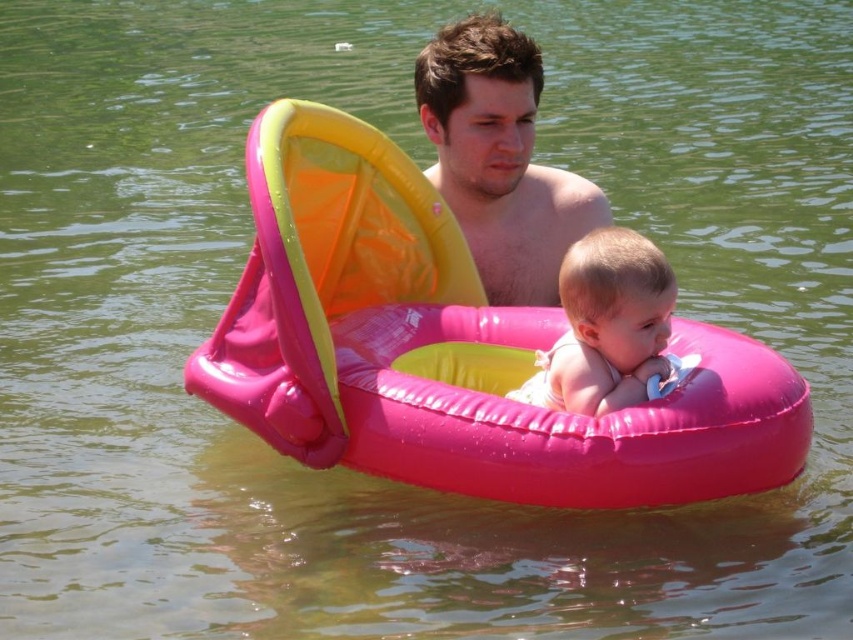
Question: Which point is farther from the camera taking this photo?

Choices:
 (A) coord(468,240)
 (B) coord(519,300)

Answer: (A)

Question: Is shiny brown hair at upper center thinner than shiny skin at center?

Choices:
 (A) yes
 (B) no

Answer: (B)

Question: Can you confirm if pink rubber baby float at center is positioned to the left of shiny skin at center?

Choices:
 (A) yes
 (B) no

Answer: (B)

Question: Can you confirm if shiny brown hair at upper center is positioned above shiny skin at center?

Choices:
 (A) yes
 (B) no

Answer: (A)

Question: Which is nearer to the pink rubber baby float at center?

Choices:
 (A) shiny skin at center
 (B) shiny brown hair at upper center

Answer: (B)

Question: Which object appears closest to the camera in this image?

Choices:
 (A) shiny skin at center
 (B) pink rubber baby float at center
 (C) shiny brown hair at upper center

Answer: (B)